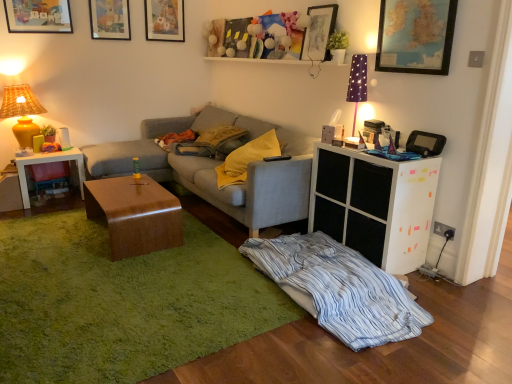
You are a GUI agent. You are given a task and a screenshot of the screen. Output one action in this format:
    pyautogui.click(x=<x>, y=<y>)
    Task: Click on the vacant space positioned to the left of glossy wood coffee table at center
    
    Given the screenshot: What is the action you would take?
    pyautogui.click(x=55, y=229)